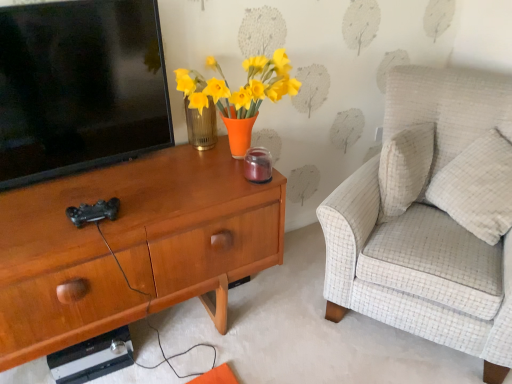
The height and width of the screenshot is (384, 512). What are the coordinates of `woodendesk at left` in the screenshot? It's located at (132, 246).

Locate an element on the screen. This screenshot has width=512, height=384. light beige fabric armchair at right is located at coordinates (423, 222).

Is white textured pillow at right inside black glossy television at left?

No, white textured pillow at right is not a part of black glossy television at left.

Who is shorter, black glossy television at left or white textured pillow at right?

white textured pillow at right is shorter.

Is black glossy television at left far away from white textured pillow at right?

Absolutely, black glossy television at left is distant from white textured pillow at right.

From a real-world perspective, is woodendesk at left physically located above or below white textured pillow at right?

From a real-world perspective, woodendesk at left is physically below white textured pillow at right.

From the image's perspective, is woodendesk at left above or below white textured pillow at right?

Clearly, from the image's perspective, woodendesk at left is below white textured pillow at right.

Which of these two, woodendesk at left or white textured pillow at right, stands taller?

woodendesk at left is taller.

Is woodendesk at left in contact with white textured pillow at right?

No, woodendesk at left is not touching white textured pillow at right.

Is black glossy television at left beside woodendesk at left?

They are not placed beside each other.

Is black glossy television at left turned away from woodendesk at left?

No, woodendesk at left is not at the back of black glossy television at left.

Which is more to the left, black glossy television at left or woodendesk at left?

Positioned to the left is black glossy television at left.

Is black glossy television at left not inside woodendesk at left?

Yes.

Is white textured pillow at right taller or shorter than black glossy television at left?

In the image, white textured pillow at right appears to be shorter than black glossy television at left.

Is white textured pillow at right in front of or behind black glossy television at left in the image?

Clearly, white textured pillow at right is behind black glossy television at left.

How far apart are white textured pillow at right and black glossy television at left?

1.38 meters.

Measure the distance between white textured pillow at right and woodendesk at left.

white textured pillow at right and woodendesk at left are 3.46 feet apart from each other.

Which of these two, white textured pillow at right or woodendesk at left, is smaller?

With smaller size is white textured pillow at right.

Between white textured pillow at right and woodendesk at left, which one is positioned behind?

white textured pillow at right is further away from the camera.

From a real-world perspective, is white textured pillow at right beneath woodendesk at left?

No, from a real-world perspective, white textured pillow at right is not beneath woodendesk at left.

From the image's perspective, would you say light beige fabric armchair at right is shown under white textured pillow at right?

Yes, from the image's perspective, light beige fabric armchair at right is below white textured pillow at right.

From a real-world perspective, is light beige fabric armchair at right positioned under white textured pillow at right based on gravity?

Yes.

Based on their positions, is light beige fabric armchair at right located to the left or right of white textured pillow at right?

Clearly, light beige fabric armchair at right is on the left of white textured pillow at right in the image.

Is light beige fabric armchair at right directly adjacent to white textured pillow at right?

No, light beige fabric armchair at right is not with white textured pillow at right.

Looking at this image, can you confirm if black glossy television at left is shorter than light beige fabric armchair at right?

Correct, black glossy television at left is not as tall as light beige fabric armchair at right.

From a real-world perspective, is black glossy television at left located higher than light beige fabric armchair at right?

Correct, in the physical world, black glossy television at left is higher than light beige fabric armchair at right.

Considering the relative positions of black glossy television at left and light beige fabric armchair at right in the image provided, is black glossy television at left to the left or to the right of light beige fabric armchair at right?

From the image, it's evident that black glossy television at left is to the left of light beige fabric armchair at right.

Is black glossy television at left turned away from light beige fabric armchair at right?

No, black glossy television at left is not facing the opposite direction of light beige fabric armchair at right.

Locate an element on the screen. This screenshot has width=512, height=384. pillow below the black glossy television at left (from the image's perspective) is located at coordinates (477, 187).

The height and width of the screenshot is (384, 512). In order to click on desk below the white textured pillow at right (from a real-world perspective) in this screenshot , I will do `click(132, 246)`.

Considering their positions, is white textured pillow at right positioned further to black glossy television at left than woodendesk at left?

white textured pillow at right.

Which object lies nearer to the anchor point black glossy television at left, woodendesk at left or light beige fabric armchair at right?

woodendesk at left lies closer to black glossy television at left than the other object.

From the image, which object appears to be farther from white textured pillow at right, black glossy television at left or light beige fabric armchair at right?

black glossy television at left is positioned further to the anchor white textured pillow at right.

Based on their spatial positions, is light beige fabric armchair at right or woodendesk at left closer to white textured pillow at right?

Among the two, light beige fabric armchair at right is located nearer to white textured pillow at right.

Which object lies further to the anchor point white textured pillow at right, woodendesk at left or black glossy television at left?

The object further to white textured pillow at right is black glossy television at left.

Based on their spatial positions, is black glossy television at left or white textured pillow at right further from light beige fabric armchair at right?

Based on the image, black glossy television at left appears to be further to light beige fabric armchair at right.

Estimate the real-world distances between objects in this image. Which object is further from white textured pillow at right, light beige fabric armchair at right or black glossy television at left?

Among the two, black glossy television at left is located further to white textured pillow at right.

In the scene shown: From the image, which object appears to be nearer to light beige fabric armchair at right, woodendesk at left or white textured pillow at right?

Based on the image, white textured pillow at right appears to be nearer to light beige fabric armchair at right.

Locate an element on the screen. desk located between black glossy television at left and light beige fabric armchair at right in the left-right direction is located at coordinates (132, 246).

The height and width of the screenshot is (384, 512). What are the coordinates of `chair between black glossy television at left and white textured pillow at right from left to right` in the screenshot? It's located at (423, 222).

Identify the location of desk between black glossy television at left and white textured pillow at right from left to right. (132, 246).

Find the location of a particular element. chair between woodendesk at left and white textured pillow at right in the horizontal direction is located at coordinates (423, 222).